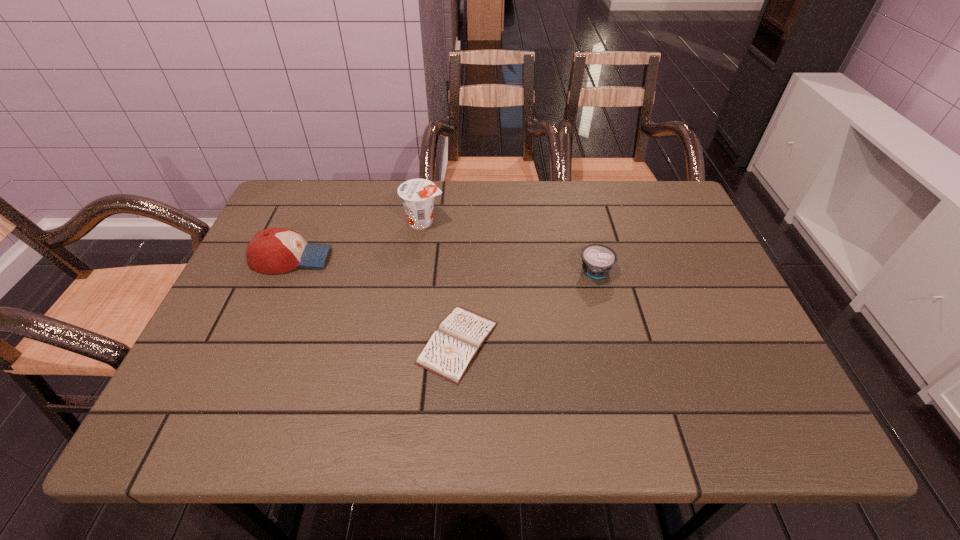
The width and height of the screenshot is (960, 540). In order to click on the farthest object in this screenshot , I will do `click(417, 195)`.

Identify the location of the tallest object. This screenshot has width=960, height=540. (417, 195).

The image size is (960, 540). Identify the location of baseball cap. tap(275, 250).

You are a GUI agent. You are given a task and a screenshot of the screen. Output one action in this format:
    pyautogui.click(x=<x>, y=<y>)
    Task: Click on the third shortest object
    This screenshot has width=960, height=540.
    Given the screenshot: What is the action you would take?
    pyautogui.click(x=275, y=250)

Where is `the nearer yogurt`? the nearer yogurt is located at coordinates (597, 260).

Locate an element on the screen. Image resolution: width=960 pixels, height=540 pixels. the right yogurt is located at coordinates (597, 260).

Locate an element on the screen. The height and width of the screenshot is (540, 960). diary is located at coordinates (450, 351).

This screenshot has height=540, width=960. What are the coordinates of `the shortest object` in the screenshot? It's located at (450, 351).

What are the coordinates of `free space located 0.090m on the right of the farther yogurt` in the screenshot? It's located at (476, 222).

Locate an element on the screen. free space located 0.230m on the front-facing side of the third shortest object is located at coordinates (420, 259).